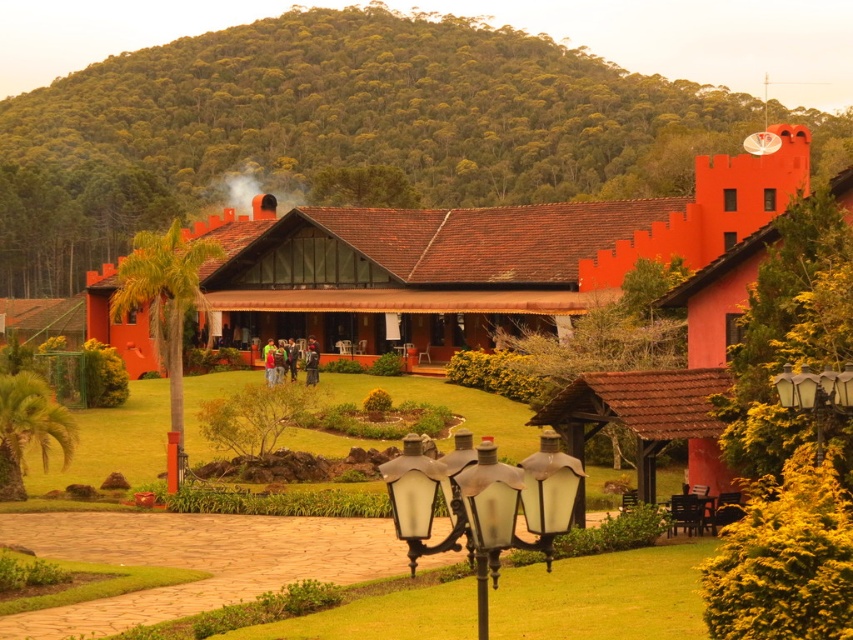
From the picture: You are a guest approaching the building and notice two lamp posts. Which lamp post, the matte black lamp post at center or the matte glass lamp post at right, would you see first as you walk towards the building?

The matte black lamp post at center is in front of the matte glass lamp post at right, so you would see the matte black lamp post at center first as you walk towards the building.

You are standing at the entrance of the orange building with a terracotta roof and want to walk towards the two points marked on the lawn. The first point is at coordinate point (167, 93) and the second is at point (509, 532). Which point will you reach first?

You will reach point (167, 93) first because it is closer to you than point (509, 532), which is further away.

You are a landscape architect designing a new pathway between the matte black lamp post at center and the matte glass lamp post at right. The pathway must be straight and 10 feet wide. Can you fit this pathway between them without overlapping either lamp post?

The distance between the matte black lamp post at center and the matte glass lamp post at right is 30.34 feet. Since the pathway only needs to be 10 feet wide, there is sufficient space to place it between them without overlapping either lamp post.